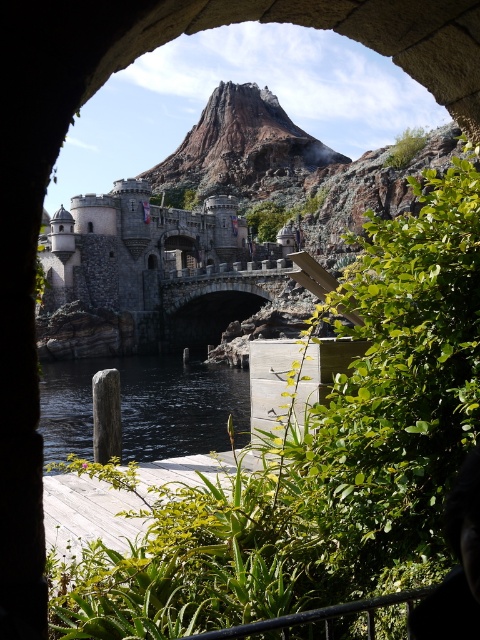
Question: Among these objects, which one is nearest to the camera?

Choices:
 (A) stone bridge at center
 (B) green leafy plant at center

Answer: (B)

Question: Can you confirm if green leafy plant at center is wider than black smooth water at lower center?

Choices:
 (A) yes
 (B) no

Answer: (A)

Question: Which point is closer to the camera?

Choices:
 (A) green leafy plant at center
 (B) black smooth water at lower center
 (C) stone bridge at center

Answer: (A)

Question: Does green leafy plant at center appear over black smooth water at lower center?

Choices:
 (A) no
 (B) yes

Answer: (B)

Question: Does stone bridge at center appear under black smooth water at lower center?

Choices:
 (A) no
 (B) yes

Answer: (A)

Question: Which is farther from the stone bridge at center?

Choices:
 (A) black smooth water at lower center
 (B) green leafy plant at center

Answer: (B)